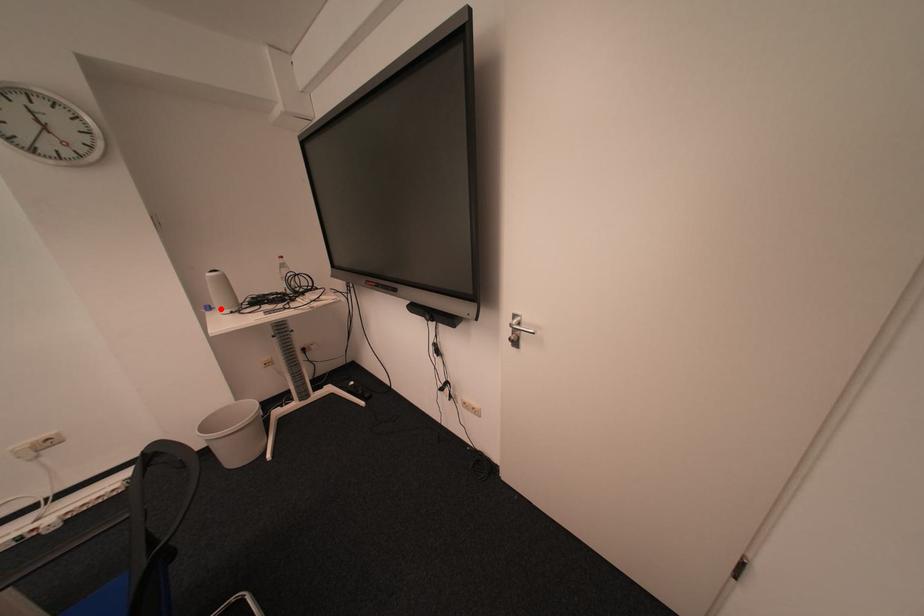
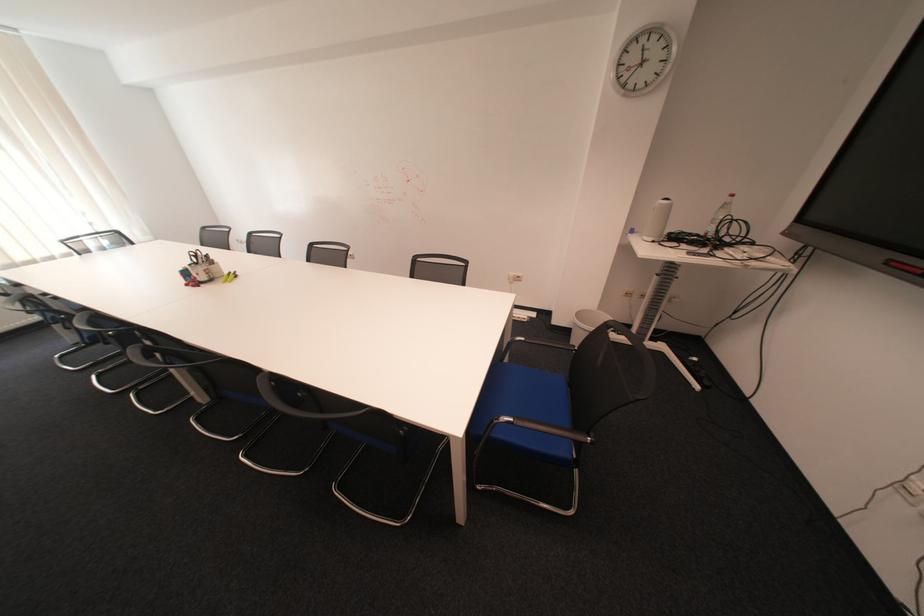
The point at the highlighted location is marked in the first image. Where is the corresponding point in the second image?

(643, 232)